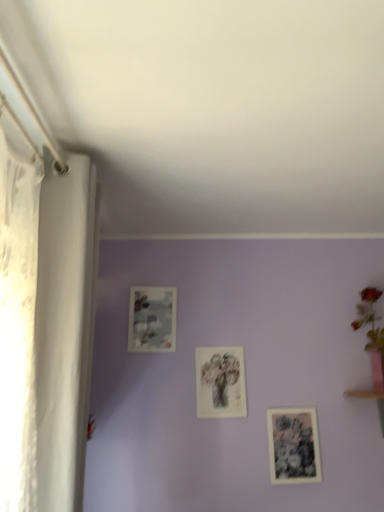
Question: From the image's perspective, is matte floral print at upper center, positioned as the 1th picture frame in top-to-bottom order, located above black paper picture frame at lower right, arranged as the 3th picture frame when viewed from the left?

Choices:
 (A) no
 (B) yes

Answer: (B)

Question: Does matte floral print at upper center, positioned as the 1th picture frame in top-to-bottom order, have a smaller size compared to black paper picture frame at lower right, arranged as the first picture frame when viewed from the right?

Choices:
 (A) no
 (B) yes

Answer: (A)

Question: From the image's perspective, is matte floral print at upper center, the 3th picture frame in the right-to-left sequence, located beneath black paper picture frame at lower right, the third picture frame from the top?

Choices:
 (A) yes
 (B) no

Answer: (B)

Question: Is matte floral print at upper center, marked as the third picture frame in a bottom-to-top arrangement, facing towards black paper picture frame at lower right, the third picture frame from the top?

Choices:
 (A) no
 (B) yes

Answer: (A)

Question: Is matte floral print at upper center, the 3th picture frame in the right-to-left sequence, positioned beyond the bounds of black paper picture frame at lower right, arranged as the first picture frame when viewed from the right?

Choices:
 (A) no
 (B) yes

Answer: (B)

Question: In terms of width, does pink ceramic vase at upper right look wider or thinner when compared to matte floral print at upper center, positioned as the 1th picture frame in top-to-bottom order?

Choices:
 (A) wide
 (B) thin

Answer: (A)

Question: From a real-world perspective, is pink ceramic vase at upper right physically located above or below matte floral print at upper center, marked as the third picture frame in a bottom-to-top arrangement?

Choices:
 (A) above
 (B) below

Answer: (B)

Question: From the image's perspective, is pink ceramic vase at upper right located above or below matte floral print at upper center, positioned as the 1th picture frame in top-to-bottom order?

Choices:
 (A) below
 (B) above

Answer: (A)

Question: In the image, is pink ceramic vase at upper right positioned in front of or behind matte floral print at upper center, positioned as the 1th picture frame in top-to-bottom order?

Choices:
 (A) behind
 (B) front

Answer: (B)

Question: In terms of width, does matte floral print at upper center, the 3th picture frame in the right-to-left sequence, look wider or thinner when compared to matte floral print at center, arranged as the 2th picture frame when viewed from the left?

Choices:
 (A) wide
 (B) thin

Answer: (A)

Question: Would you say matte floral print at upper center, placed as the 1th picture frame when sorted from left to right, is to the left or to the right of matte floral print at center, which appears as the second picture frame when ordered from the bottom, in the picture?

Choices:
 (A) left
 (B) right

Answer: (A)

Question: Is matte floral print at upper center, placed as the 1th picture frame when sorted from left to right, bigger or smaller than matte floral print at center, which appears as the second picture frame when ordered from the bottom?

Choices:
 (A) small
 (B) big

Answer: (B)

Question: From a real-world perspective, is matte floral print at upper center, the 3th picture frame in the right-to-left sequence, physically located above or below matte floral print at center, arranged as the 2th picture frame when viewed from the left?

Choices:
 (A) below
 (B) above

Answer: (B)

Question: Is pink ceramic vase at upper right inside or outside of matte floral print at center, arranged as the 2th picture frame when viewed from the left?

Choices:
 (A) inside
 (B) outside

Answer: (B)

Question: In terms of width, does pink ceramic vase at upper right look wider or thinner when compared to matte floral print at center, which is the 2th picture frame in right-to-left order?

Choices:
 (A) wide
 (B) thin

Answer: (A)